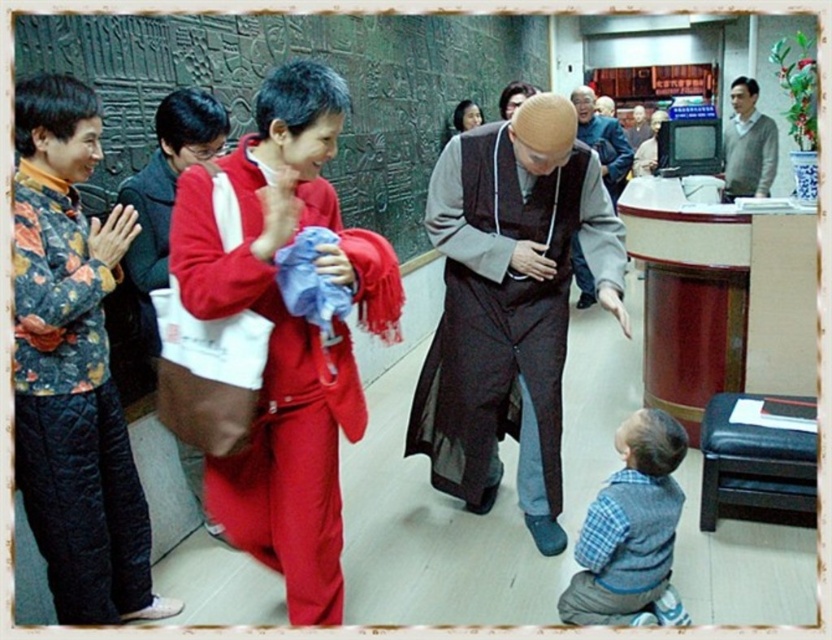
Question: Does gray sweater at upper right have a larger size compared to smooth brown wooden table at center?

Choices:
 (A) no
 (B) yes

Answer: (B)

Question: Can you confirm if matte black robe at center is positioned below smooth brown wooden table at center?

Choices:
 (A) yes
 (B) no

Answer: (A)

Question: Which point appears farthest from the camera in this image?

Choices:
 (A) tap(106, 403)
 (B) tap(630, 129)
 (C) tap(771, 147)
 (D) tap(545, 380)

Answer: (B)

Question: Which of these objects is positioned closest to the smooth brown wooden table at center?

Choices:
 (A) brown matte robe at center
 (B) matte red robe at center
 (C) floral quilted robe at left

Answer: (A)

Question: Which of the following is the closest to the observer?

Choices:
 (A) (642, 520)
 (B) (646, 116)
 (C) (380, 262)

Answer: (C)

Question: Does brown matte robe at center appear under matte black robe at center?

Choices:
 (A) no
 (B) yes

Answer: (B)